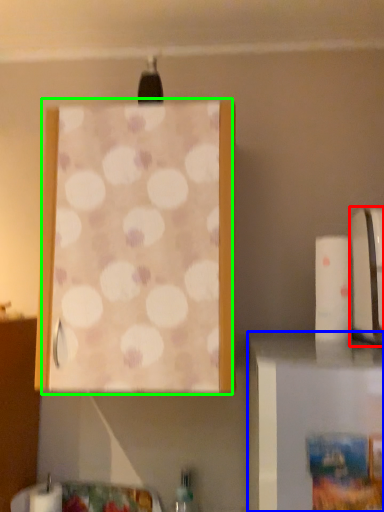
Question: Estimate the real-world distances between objects in this image. Which object is closer to appliance (highlighted by a red box), furniture (highlighted by a blue box) or curtain (highlighted by a green box)?

Choices:
 (A) furniture
 (B) curtain

Answer: (A)